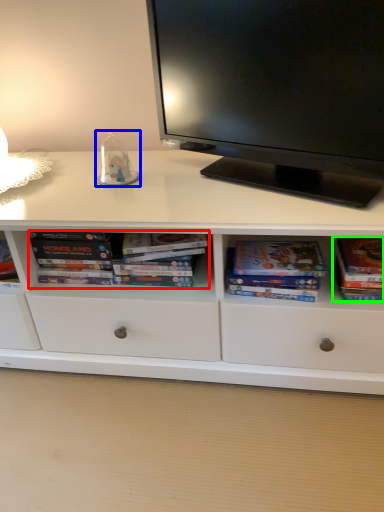
Question: Which object is the closest to the book (highlighted by a red box)? Choose among these: toy (highlighted by a blue box) or paperback book (highlighted by a green box).

Choices:
 (A) toy
 (B) paperback book

Answer: (A)